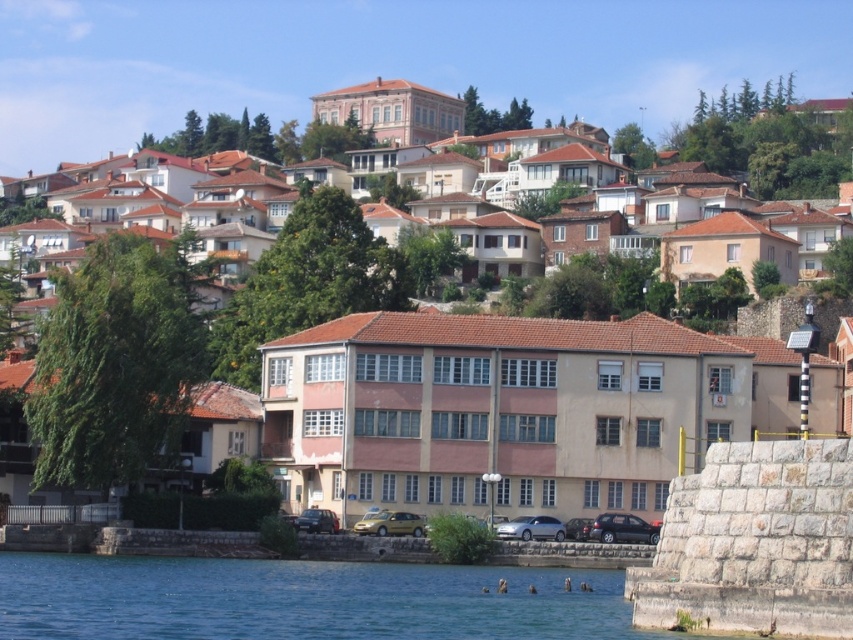
Which of these two, satin silver car at lower center or metallic silver car at lower center, stands shorter?

With less height is metallic silver car at lower center.

The height and width of the screenshot is (640, 853). Describe the element at coordinates (531, 529) in the screenshot. I see `satin silver car at lower center` at that location.

Measure the distance between satin silver car at lower center and camera.

satin silver car at lower center is 93.93 meters from camera.

The width and height of the screenshot is (853, 640). I want to click on satin silver car at lower center, so click(531, 529).

Between pink matte building at center and blue water at lower left, which one is positioned higher?

Positioned higher is pink matte building at center.

Does pink matte building at center have a greater height compared to blue water at lower left?

Correct, pink matte building at center is much taller as blue water at lower left.

Is point (543, 280) positioned before point (12, 563)?

No.

You are a GUI agent. You are given a task and a screenshot of the screen. Output one action in this format:
    pyautogui.click(x=<x>, y=<y>)
    Task: Click on the pink matte building at center
    
    Given the screenshot: What is the action you would take?
    pyautogui.click(x=541, y=362)

Which is above, pink matte building at center or metallic silver car at center?

pink matte building at center

Who is positioned more to the left, pink matte building at center or metallic silver car at center?

metallic silver car at center

Is point (451, 316) positioned in front of point (570, 524)?

No, (451, 316) is further to viewer.

This screenshot has width=853, height=640. What are the coordinates of `pink matte building at center` in the screenshot? It's located at [541, 362].